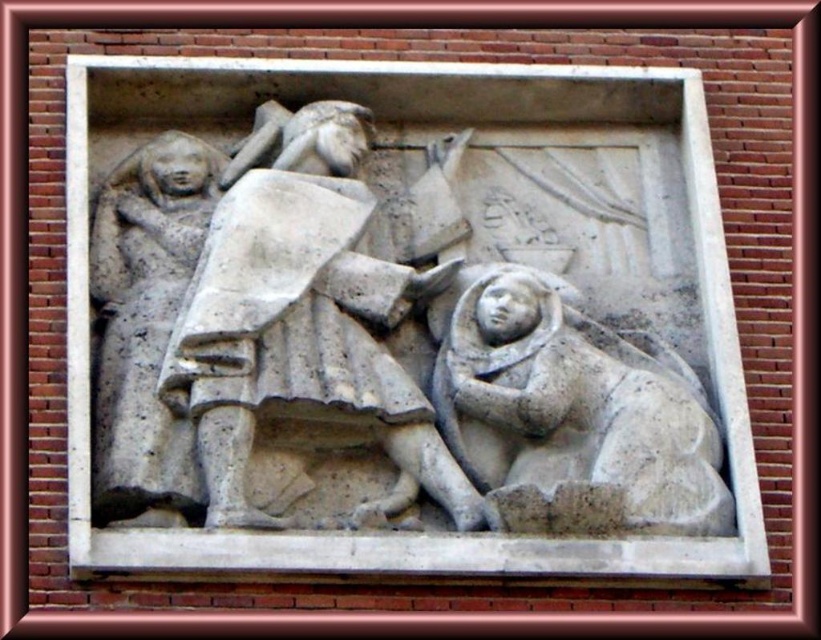
Which is in front, point (411, 380) or point (667, 440)?

Point (667, 440) is more forward.

Is point (320, 124) positioned before point (705, 484)?

No, (320, 124) is behind (705, 484).

What are the coordinates of `white stone figure at center` in the screenshot? It's located at (303, 323).

Can you confirm if white stone figure at center is thinner than smooth stone figure at left?

Incorrect, white stone figure at center's width is not less than smooth stone figure at left's.

Who is more forward, (392,298) or (104,186)?

Positioned in front is point (392,298).

Locate an element on the screen. The image size is (821, 640). white stone figure at center is located at coordinates (303, 323).

Between point (686, 518) and point (177, 524), which one is positioned behind?

The point (686, 518) is behind.

Which is below, gray stone figure at lower right or smooth stone figure at left?

Positioned lower is gray stone figure at lower right.

Between point (618, 460) and point (136, 253), which one is positioned in front?

Point (618, 460) is in front.

Identify the location of gray stone figure at lower right. (571, 413).